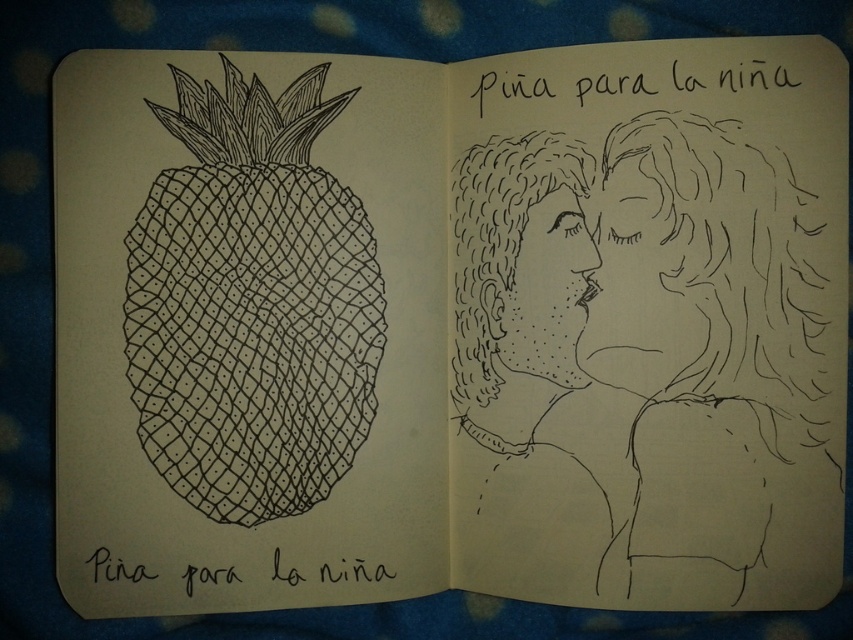
Can you confirm if black ink couple at center is smaller than black ink pineapple at left?

Incorrect, black ink couple at center is not smaller in size than black ink pineapple at left.

Who is higher up, black ink couple at center or black ink pineapple at left?

black ink pineapple at left is higher up.

Between point (573, 476) and point (209, 323), which one is positioned in front?

Point (209, 323) is more forward.

The width and height of the screenshot is (853, 640). I want to click on black ink couple at center, so click(x=637, y=355).